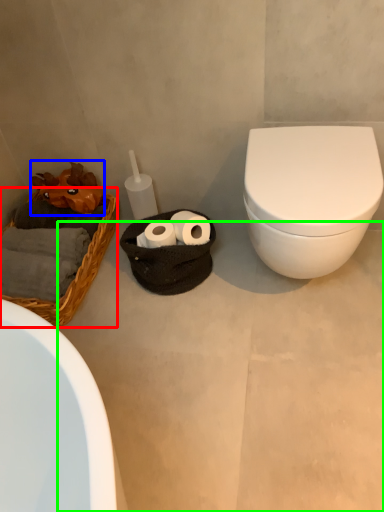
Question: Estimate the real-world distances between objects in this image. Which object is closer to basket (highlighted by a red box), chiffonier (highlighted by a blue box) or concrete (highlighted by a green box)?

Choices:
 (A) chiffonier
 (B) concrete

Answer: (A)